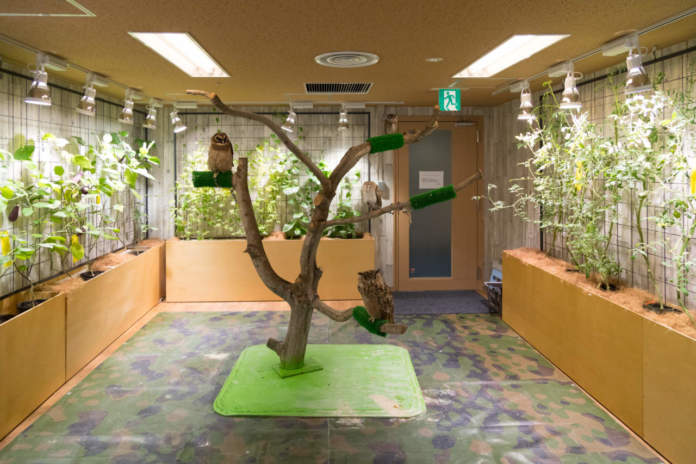
Locate an element on the screen. Image resolution: width=696 pixels, height=464 pixels. grow lamp is located at coordinates (47, 97), (90, 95), (127, 110), (149, 116), (182, 128), (291, 118), (340, 118), (527, 102), (578, 102), (633, 83).